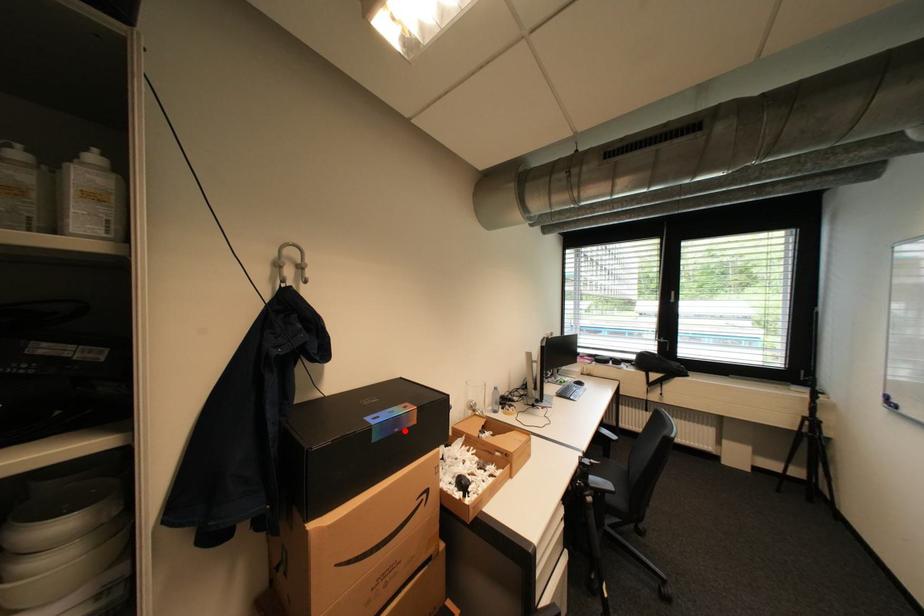
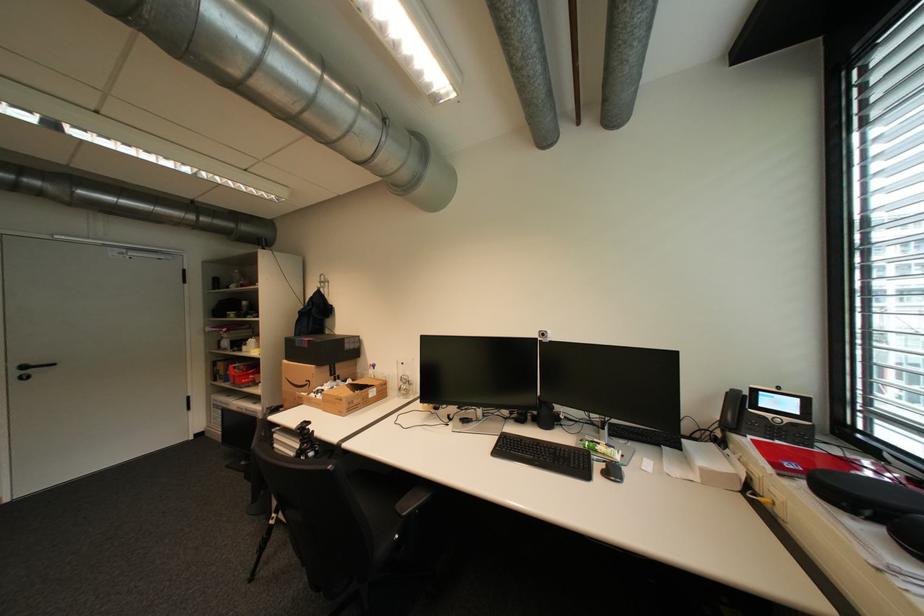
Locate, in the second image, the point that corresponds to the highlighted location in the first image.

(310, 346)